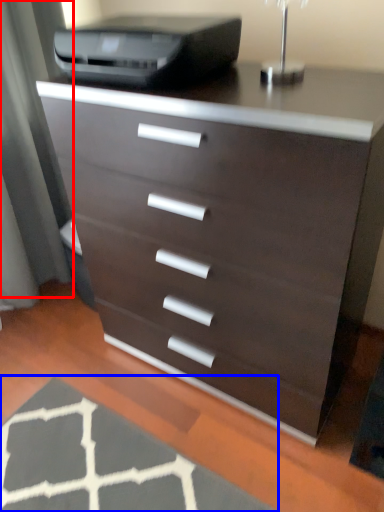
Question: Among these objects, which one is farthest to the camera, screen door (highlighted by a red box) or doormat (highlighted by a blue box)?

Choices:
 (A) screen door
 (B) doormat

Answer: (A)